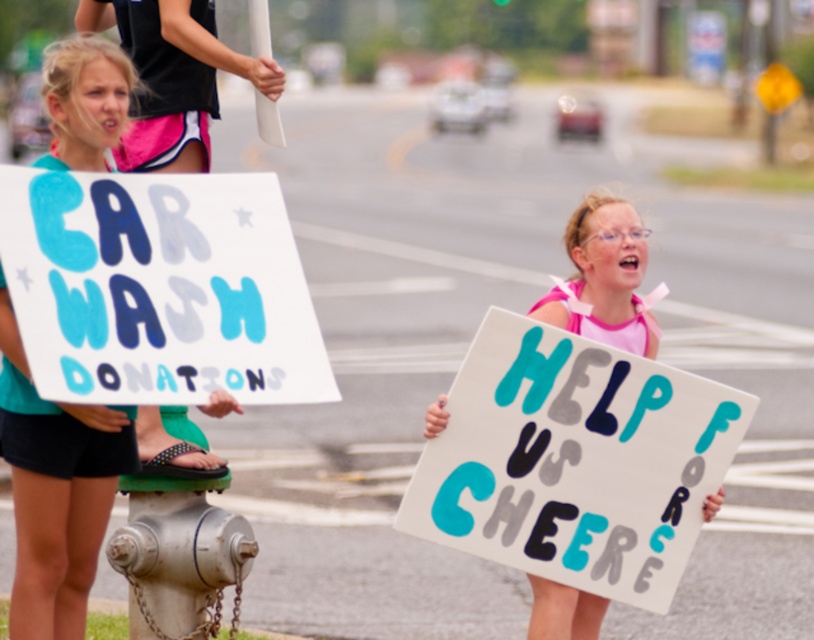
Question: Can you confirm if teal fabric sign at left is positioned to the left of silver metallic hydrant at lower left?

Choices:
 (A) yes
 (B) no

Answer: (A)

Question: Does pink fabric at center appear on the left side of silver metallic hydrant at lower left?

Choices:
 (A) yes
 (B) no

Answer: (B)

Question: Considering the real-world distances, which object is closest to the hand-painted cardboard sign at left?

Choices:
 (A) pink fabric at center
 (B) silver metallic hydrant at lower left

Answer: (B)

Question: Which object is farther from the camera taking this photo?

Choices:
 (A) silver metallic hydrant at lower left
 (B) pink fabric at center

Answer: (A)

Question: Which object is farther from the camera taking this photo?

Choices:
 (A) pink fabric at center
 (B) hand-painted cardboard sign at left
 (C) silver metallic hydrant at lower left

Answer: (C)

Question: Is hand-painted cardboard sign at left in front of teal fabric sign at left?

Choices:
 (A) yes
 (B) no

Answer: (A)